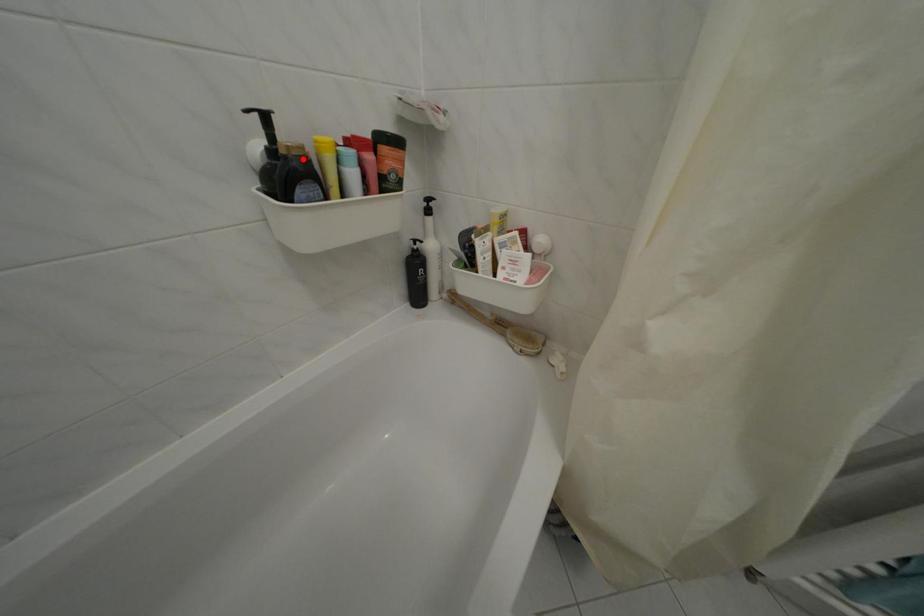
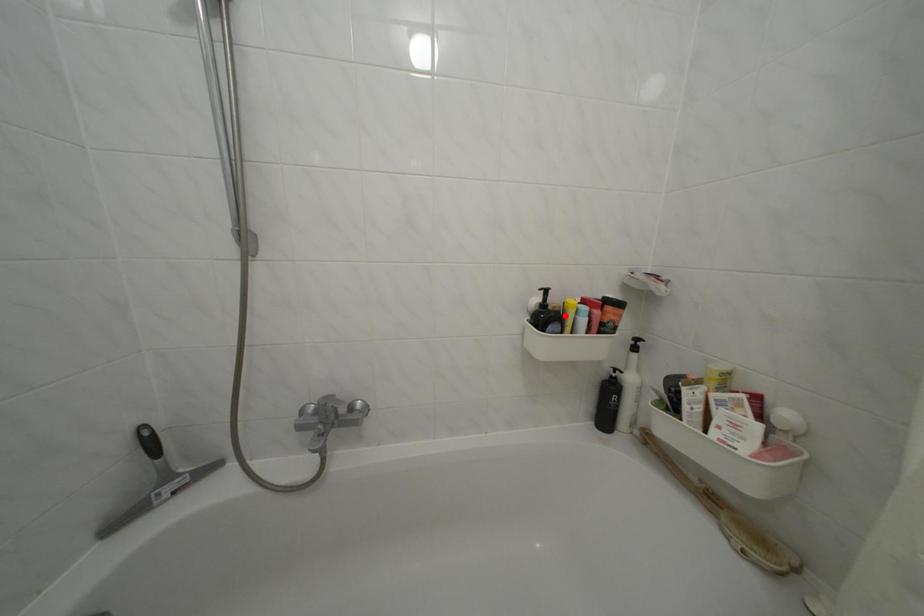
In the scene shown: I am providing you with two images of the same scene from different viewpoints. A red point is marked on the first image and another point is marked on the second image. Are the points marked in image1 and image2 representing the same 3D position?

Yes